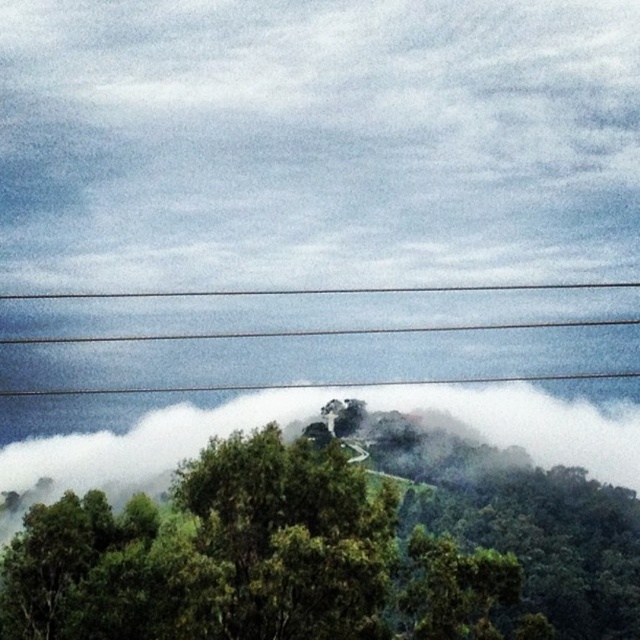
Does green leafy tree at center come in front of smooth wire at upper center?

Yes, green leafy tree at center is in front of smooth wire at upper center.

The image size is (640, 640). What are the coordinates of `green leafy tree at center` in the screenshot? It's located at (330, 548).